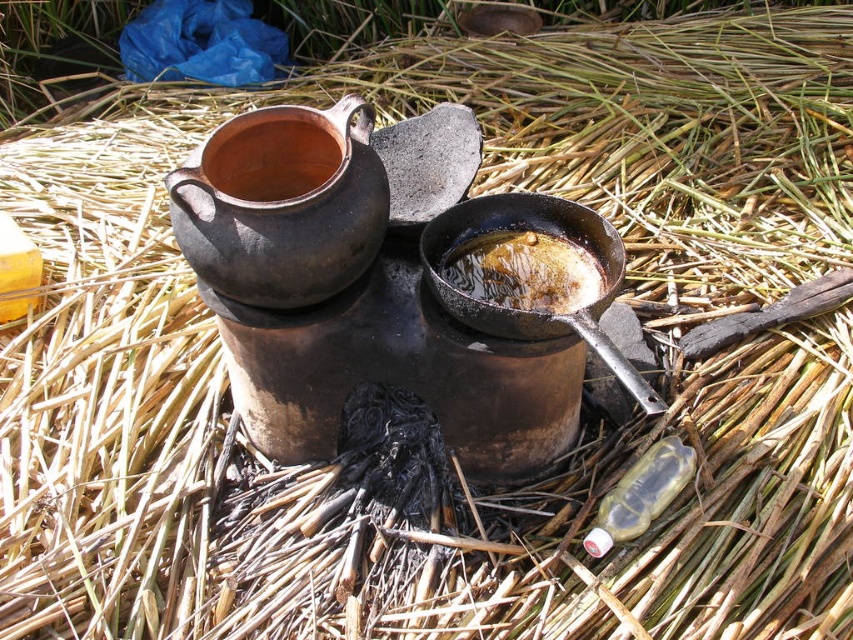
You are standing in front of the rustic outdoor cooking setup. There are two points marked on the image, point (338, 278) and point (245, 164). Which point is closer to you?

Point (338, 278) is closer to the camera than point (245, 164).

You are standing in front of the rustic outdoor cooking setup. There are two points marked on the image, point 1 at coordinates point (x=531, y=273) and point 2 at coordinates point (x=248, y=129). Which point is closer to you?

Point (x=248, y=129) is closer to you because it is less further to the camera than point (x=531, y=273).

You are setting up a rustic outdoor cooking area and have a matte clay teapot at upper left and another object. You want to place them at least 1.06 meters apart for safety. Are they currently spaced appropriately?

The matte clay teapot at upper left and the other object are already 1.06 meters apart, so they are spaced appropriately for safety.